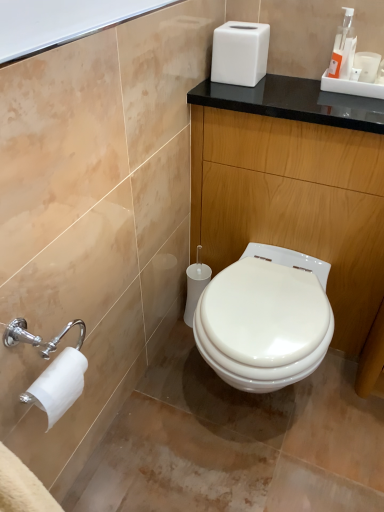
Question: In the image, is white matte tissue box at upper center positioned in front of or behind white matte toilet paper at lower left?

Choices:
 (A) front
 (B) behind

Answer: (B)

Question: In the image, is white matte tissue box at upper center on the left side or the right side of white matte toilet paper at lower left?

Choices:
 (A) right
 (B) left

Answer: (A)

Question: Which is nearer to the black glossy counter at center?

Choices:
 (A) white matte toilet paper at lower left
 (B) white matte tissue box at upper center
 (C) orange plastic soap dispenser at upper right

Answer: (B)

Question: Based on their relative distances, which object is nearer to the white matte tissue box at upper center?

Choices:
 (A) orange plastic soap dispenser at upper right
 (B) white matte toilet paper at lower left
 (C) black glossy counter at center

Answer: (A)